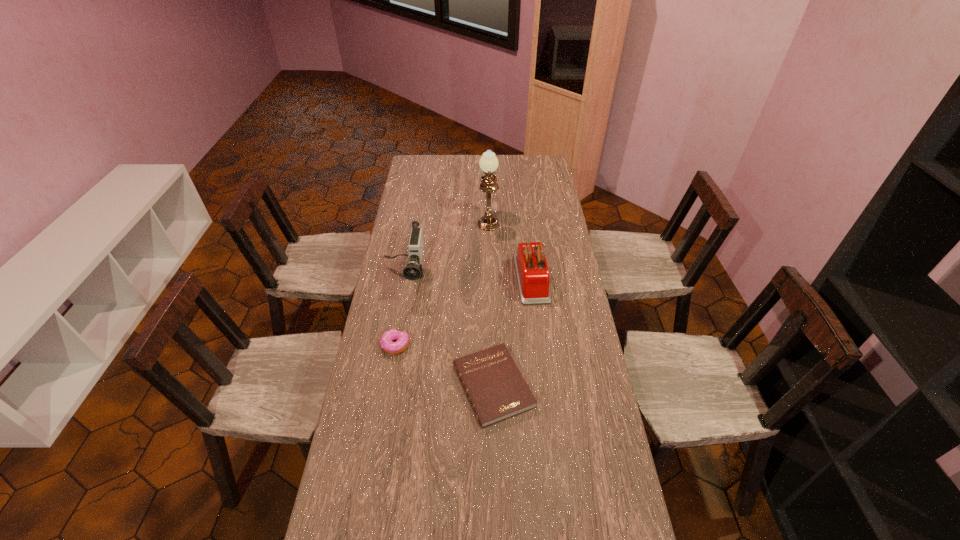
The height and width of the screenshot is (540, 960). I want to click on blank region between the shortest object and the farthest object, so click(x=491, y=302).

The image size is (960, 540). Find the location of `free point between the shortest object and the second shortest object`. free point between the shortest object and the second shortest object is located at coordinates (444, 366).

The image size is (960, 540). Identify the location of empty location between the camcorder and the shortest object. (449, 331).

This screenshot has height=540, width=960. Identify the location of free point between the doughnut and the hardback book. (444, 366).

Identify the location of vacant space that is in between the farthest object and the toaster. (510, 248).

I want to click on vacant point located between the camcorder and the farthest object, so click(446, 247).

Identify the location of free space that is in between the farthest object and the shortest object. (491, 302).

The height and width of the screenshot is (540, 960). Identify the location of vacant space in between the farthest object and the hardback book. (491, 302).

Locate which object ranks fourth in proximity to the shortest object. Please provide its 2D coordinates. Your answer should be formatted as a tuple, i.e. [(x, y)], where the tuple contains the x and y coordinates of a point satisfying the conditions above.

[(488, 163)]

I want to click on object that is the third nearest to the camcorder, so point(496,389).